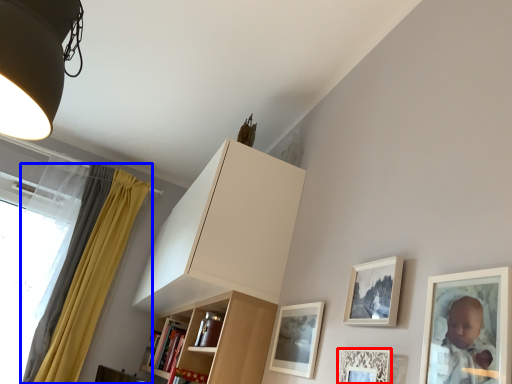
Question: Which object appears closest to the camera in this image, picture frame (highlighted by a red box) or curtain (highlighted by a blue box)?

Choices:
 (A) picture frame
 (B) curtain

Answer: (A)